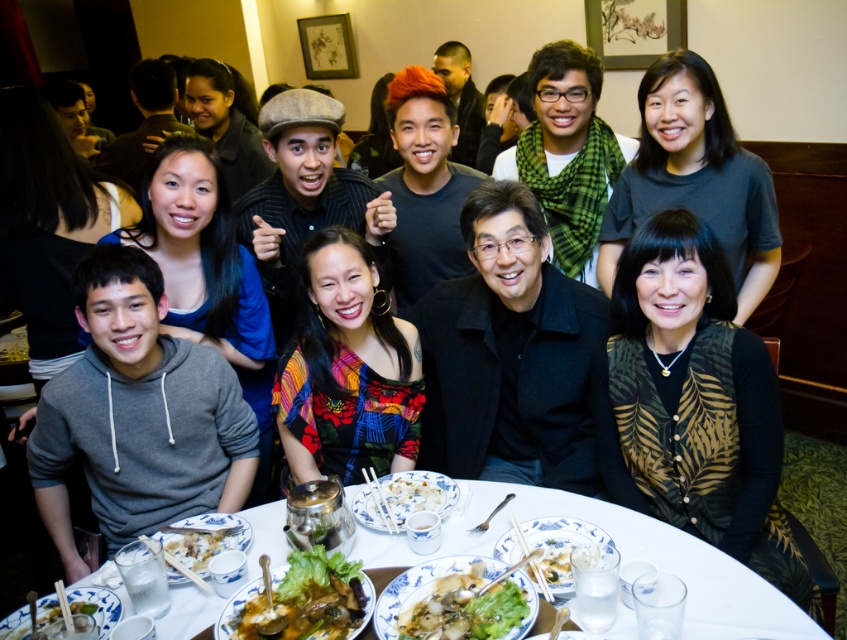
Question: Does green leafy vegetable at center have a larger size compared to white porcelain bowl at center?

Choices:
 (A) yes
 (B) no

Answer: (A)

Question: Which object is positioned closest to the white porcelain platter at center?

Choices:
 (A) white porcelain plate at center
 (B) green leafy lettuce at center
 (C) white porcelain bowl at center

Answer: (C)

Question: Observing the image, what is the correct spatial positioning of white porcelain plate at center in reference to white glossy rice bowl at center?

Choices:
 (A) above
 (B) below

Answer: (B)

Question: Which is nearer to the white glossy rice bowl at center?

Choices:
 (A) white porcelain table at center
 (B) white porcelain bowl at center

Answer: (A)

Question: Can you confirm if white porcelain plate at center is bigger than white porcelain bowl at center?

Choices:
 (A) yes
 (B) no

Answer: (A)

Question: Which of the following is the farthest from the observer?

Choices:
 (A) white porcelain platter at lower left
 (B) white porcelain platter at center
 (C) green leafy lettuce at center
 (D) white glossy rice bowl at center

Answer: (D)